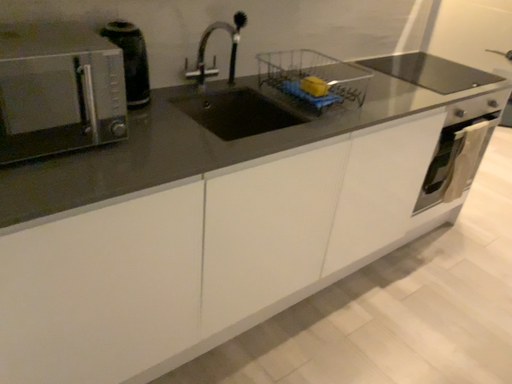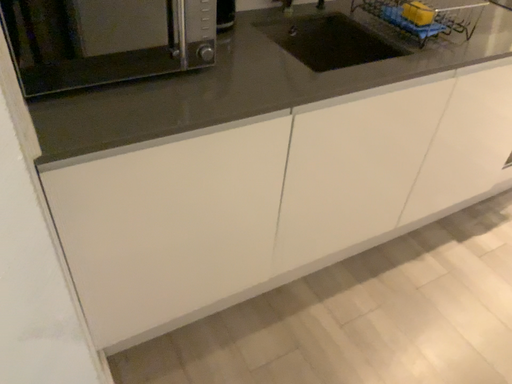
Question: How did the camera likely rotate when shooting the video?

Choices:
 (A) rotated upward
 (B) rotated downward

Answer: (B)